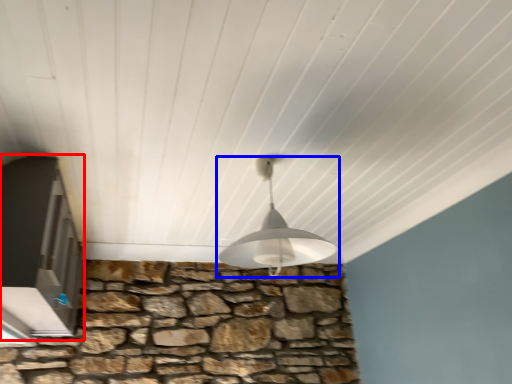
Question: Which object appears farthest to the camera in this image, window (highlighted by a red box) or lamp (highlighted by a blue box)?

Choices:
 (A) window
 (B) lamp

Answer: (A)